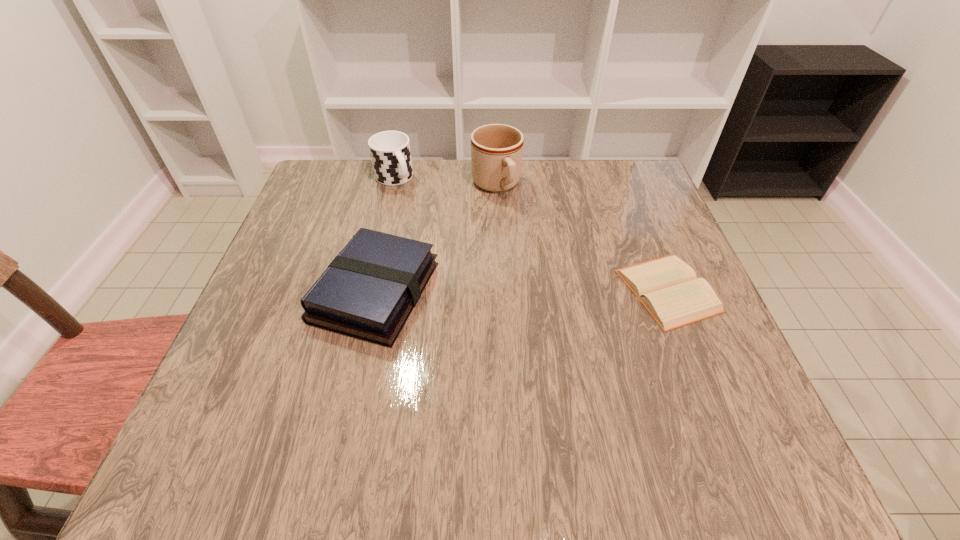
In order to click on vacant area at the left edge of the desktop in this screenshot , I will do `click(303, 289)`.

In the image, there is a desktop. Where is `free space at the right edge`? free space at the right edge is located at coordinates (616, 258).

This screenshot has width=960, height=540. In the image, there is a desktop. Identify the location of vacant area at the far left corner. (328, 171).

You are a GUI agent. You are given a task and a screenshot of the screen. Output one action in this format:
    pyautogui.click(x=<x>, y=<y>)
    Task: Click on the free space at the near left corner of the desktop
    The width and height of the screenshot is (960, 540).
    Given the screenshot: What is the action you would take?
    pyautogui.click(x=293, y=414)

Image resolution: width=960 pixels, height=540 pixels. What are the coordinates of `vacant region at the far right corner of the desktop` in the screenshot? It's located at (635, 165).

The height and width of the screenshot is (540, 960). Identify the location of vacant space at the near right corner of the desktop. (699, 370).

Find the location of a particular element. The image size is (960, 540). free space between the shortest object and the book is located at coordinates (521, 291).

Identify the location of free space that is in between the book and the tallest object. The image size is (960, 540). (436, 239).

Where is `vacant space that is in between the second object from right to left and the second tallest object`? vacant space that is in between the second object from right to left and the second tallest object is located at coordinates (444, 181).

The width and height of the screenshot is (960, 540). In order to click on free point between the rightmost object and the second tallest object in this screenshot , I will do pos(531,234).